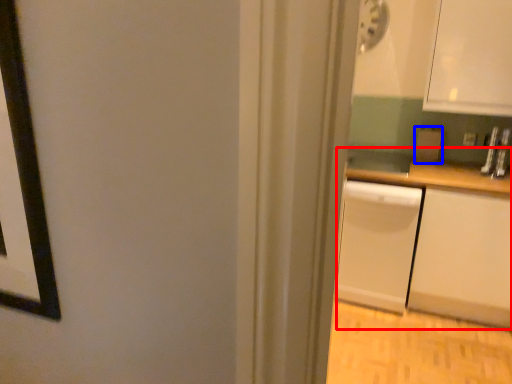
Question: Which object appears closest to the camera in this image, counter (highlighted by a red box) or appliance (highlighted by a blue box)?

Choices:
 (A) counter
 (B) appliance

Answer: (A)